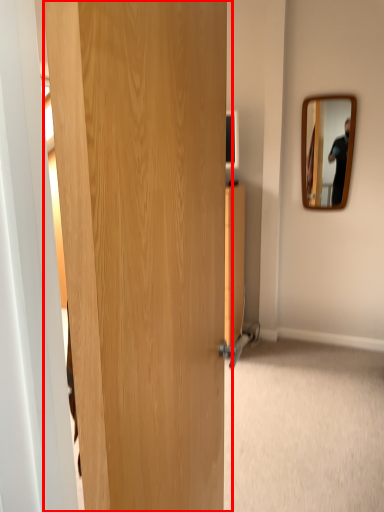
Question: In this image, where is door (annotated by the red box) located relative to mirror?

Choices:
 (A) right
 (B) left

Answer: (B)